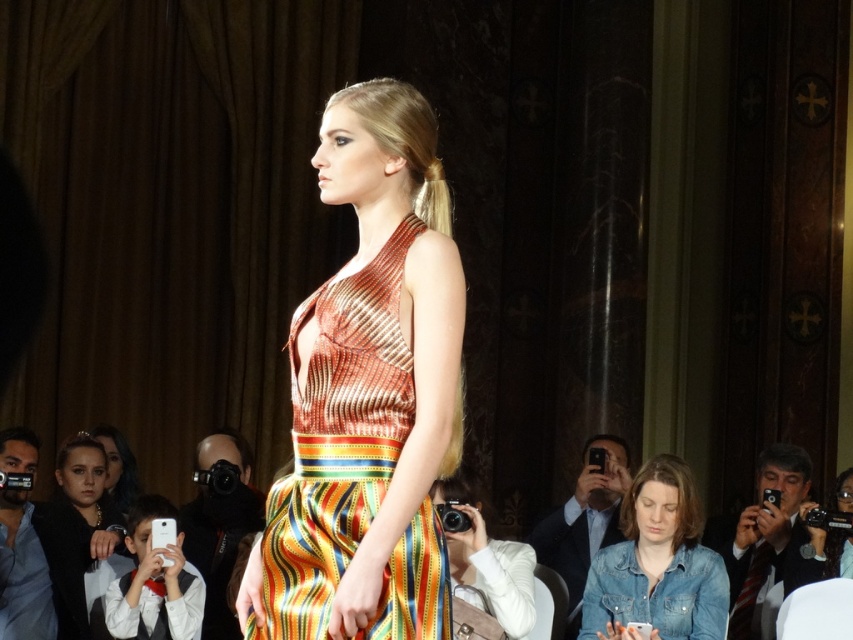
You are a photographer at the runway show. You notice two items at the lower left corner of your camera frame. One is the matte black jacket at lower left and the other is the matte black hair at lower left. Which one is positioned further to the left in the frame?

The matte black jacket at lower left is positioned further to the left than the matte black hair at lower left.